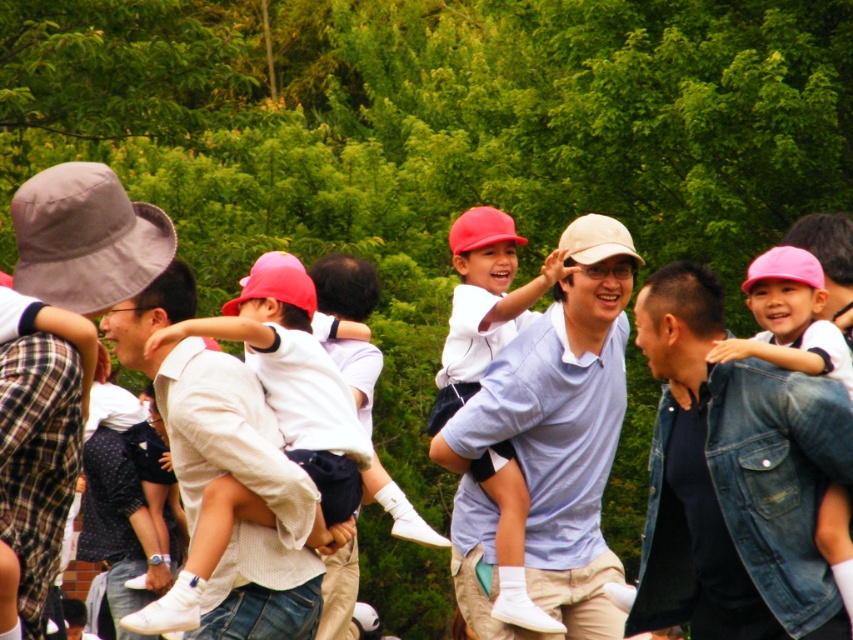
You are organizing a group photo and need to arrange two people wearing the white textured shirt at center and the matte white shirt at center side by side. Which shirt will require more space between them to accommodate their sizes?

The white textured shirt at center requires more space because its width is larger than the matte white shirt at center.

You are a photographer at the event and want to ensure both the matte white shirt at center and the pink denim jacket at center are clearly visible in your photo. Given their sizes, which one might require more careful framing to avoid being overshadowed?

The pink denim jacket at center is smaller in size compared to the matte white shirt at center, so it might require more careful framing to ensure it is not overshadowed by the larger matte white shirt at center.

You are a photographer trying to capture a photo of the matte white shirt at center and the gray fabric baseball hat at left. You want to ensure both subjects are fully visible in the frame. Based on their sizes, which object should you focus on to ensure both fit in the photo?

The matte white shirt at center is wider than the gray fabric baseball hat at left, so focusing on the matte white shirt at center would ensure both fit in the frame since it is the wider object.